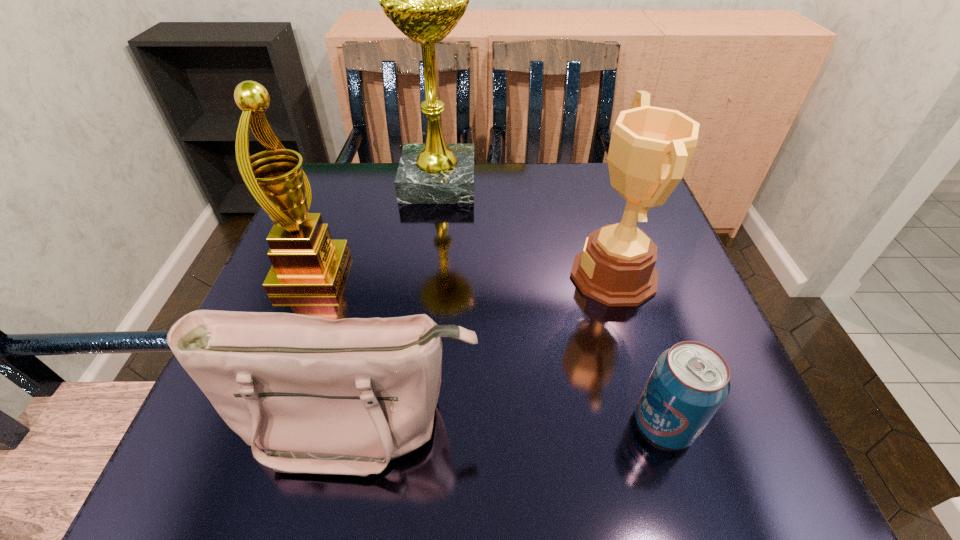
This screenshot has height=540, width=960. What are the coordinates of `unoccupied area between the leftmost award and the pop soda` in the screenshot? It's located at (488, 348).

Where is `vacant space that is in between the farthest award and the rightmost award`? Image resolution: width=960 pixels, height=540 pixels. vacant space that is in between the farthest award and the rightmost award is located at coordinates (526, 229).

In order to click on free area in between the shoulder bag and the pop soda in this screenshot , I will do `click(511, 423)`.

Locate an element on the screen. The width and height of the screenshot is (960, 540). empty space between the rightmost award and the farthest award is located at coordinates pyautogui.click(x=526, y=229).

Select which object is the closest to the rightmost award. Please provide its 2D coordinates. Your answer should be formatted as a tuple, i.e. [(x, y)], where the tuple contains the x and y coordinates of a point satisfying the conditions above.

[(689, 382)]

Identify the location of object that stands as the fourth closest to the shortest object. The height and width of the screenshot is (540, 960). (425, 0).

This screenshot has height=540, width=960. In order to click on the third closest award to the second shortest object in this screenshot , I will do `click(425, 0)`.

Find the location of a particular element. award that is the nearest to the leftmost award is located at coordinates (425, 0).

Locate an element on the screen. The width and height of the screenshot is (960, 540). free space that satisfies the following two spatial constraints: 1. on the front-facing side of the shortest object; 2. on the left side of the leftmost award is located at coordinates (252, 424).

Locate an element on the screen. blank area in the image that satisfies the following two spatial constraints: 1. on the front-facing side of the farthest award; 2. on the front pocket of the shoulder bag is located at coordinates (410, 421).